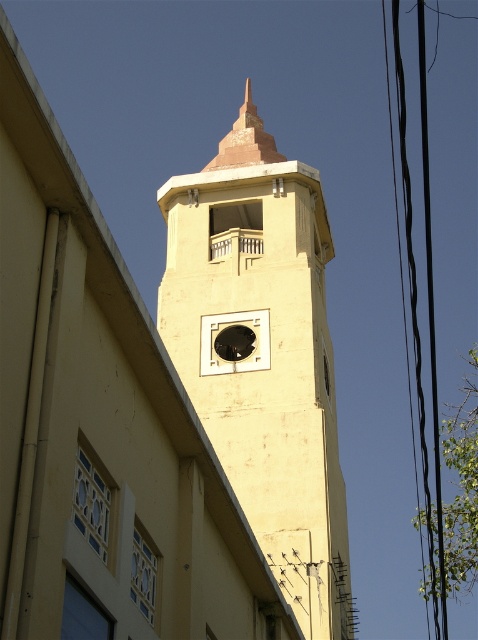
You are an architect designing a new building and want to ensure that the yellow matte clock tower at center does not block the view of the black rubber power lines at right from the main entrance. Based on their relative widths, which structure should be placed closer to the entrance to maintain visibility?

Result: The yellow matte clock tower at center is thinner than black rubber power lines at right, so to maintain visibility of the power lines, the clock tower should be placed closer to the entrance since its narrower profile will obstruct less of the view compared to the wider power lines.

You are standing in front of a building and notice a yellow matte clock tower at center and black rubber power lines at right. Which object is positioned to the left of the other?

The yellow matte clock tower at center is positioned to the left of black rubber power lines at right.

You are standing in front of a building and want to take a photo of the yellow matte clock tower at center and the black rubber power lines at right. Which object will appear larger in your photo?

The yellow matte clock tower at center will appear larger in the photo because it is closer to the viewer than the black rubber power lines at right.